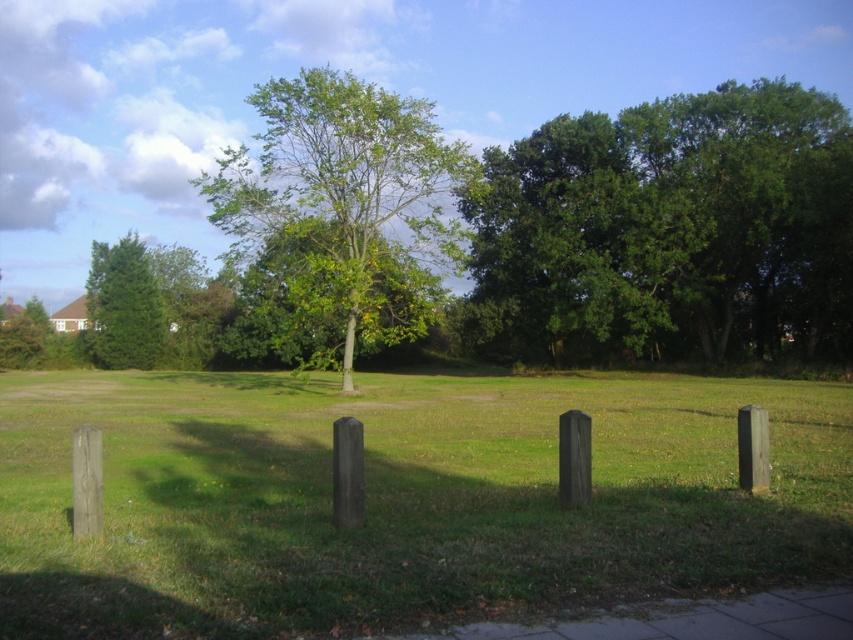
Does point (351, 122) come closer to viewer compared to point (137, 307)?

Yes, point (351, 122) is closer to viewer.

Which is above, green leafy tree at center or green matte tree at left?

green leafy tree at center is higher up.

Who is more forward, (279, 115) or (100, 282)?

Point (279, 115) is more forward.

Where is `green leafy tree at center`? The width and height of the screenshot is (853, 640). green leafy tree at center is located at coordinates (341, 173).

Who is positioned more to the left, wooden posts at center or green leafy tree at upper right?

wooden posts at center

Between wooden posts at center and green leafy tree at upper right, which one has more height?

With more height is green leafy tree at upper right.

Is point (405, 376) closer to viewer compared to point (701, 144)?

No, (405, 376) is further to viewer.

Where is `wooden posts at center`? The height and width of the screenshot is (640, 853). wooden posts at center is located at coordinates (401, 499).

Who is positioned more to the right, green leafy tree at upper right or green leafy tree at center?

Positioned to the right is green leafy tree at upper right.

This screenshot has height=640, width=853. In order to click on green leafy tree at upper right in this screenshot , I will do `click(669, 230)`.

The height and width of the screenshot is (640, 853). I want to click on green leafy tree at upper right, so click(x=669, y=230).